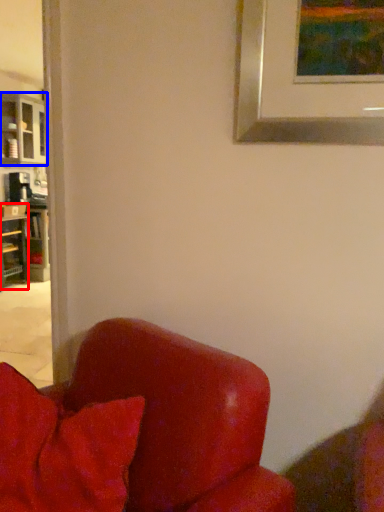
Question: Which of the following is the closest to the observer, shelf (highlighted by a red box) or cabinetry (highlighted by a blue box)?

Choices:
 (A) shelf
 (B) cabinetry

Answer: (A)